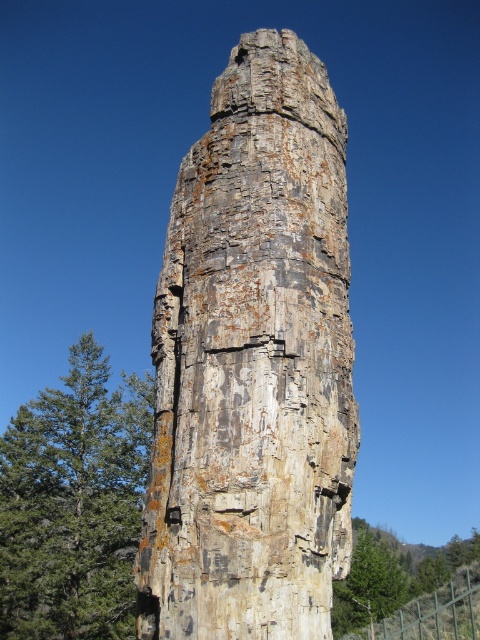
Consider the image. Does rusty stone column at center lie behind green leafy tree at center?

→ That is False.

Who is shorter, rusty stone column at center or green leafy tree at center?

rusty stone column at center

Who is more distant from viewer, (227, 262) or (388, 625)?

The point (388, 625) is behind.

This screenshot has height=640, width=480. I want to click on rusty stone column at center, so click(252, 364).

Is rusty stone column at center behind green textured tree at left?

No, rusty stone column at center is in front of green textured tree at left.

Describe the element at coordinates (252, 364) in the screenshot. Image resolution: width=480 pixels, height=640 pixels. I see `rusty stone column at center` at that location.

Locate an element on the screen. rusty stone column at center is located at coordinates (252, 364).

Which is below, green textured tree at left or green leafy tree at center?

green leafy tree at center

Identify the location of green textured tree at left. (73, 502).

Where is `green textured tree at left`? green textured tree at left is located at coordinates pyautogui.click(x=73, y=502).